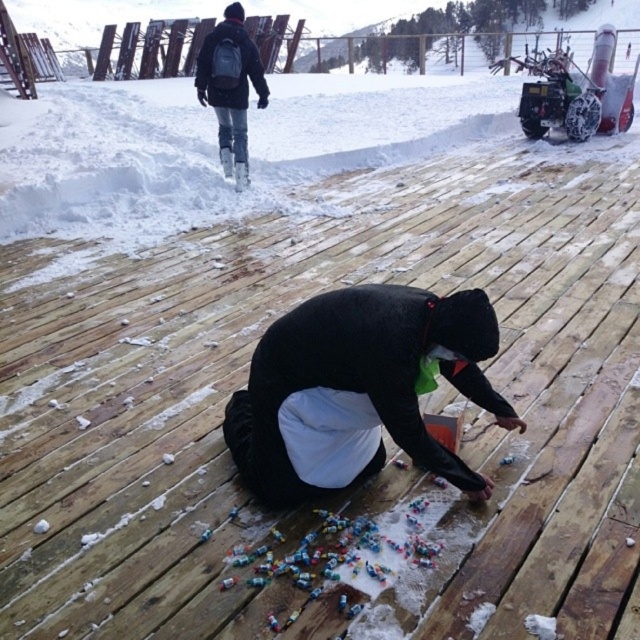
Who is shorter, black matte jacket at center or black backpack at upper left?

black matte jacket at center

Who is higher up, black matte jacket at center or black backpack at upper left?

black backpack at upper left is higher up.

Find the location of a particular element. This screenshot has width=640, height=640. black matte jacket at center is located at coordinates (358, 388).

The height and width of the screenshot is (640, 640). I want to click on black matte jacket at center, so click(358, 388).